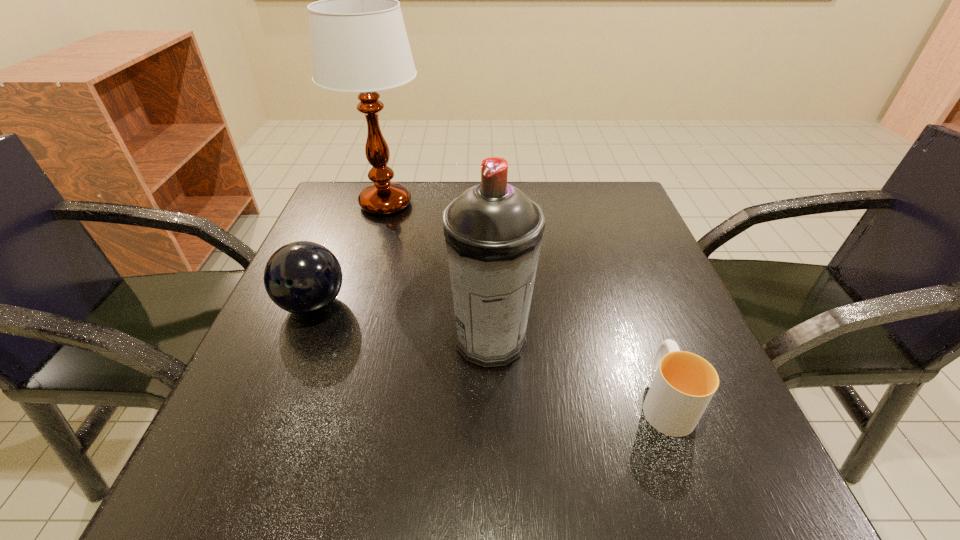
Image resolution: width=960 pixels, height=540 pixels. What are the coordinates of `vacant region that satisfies the following two spatial constraints: 1. on the side of the aerosol can with the finger holes; 2. on the right side of the bowling ball` in the screenshot? It's located at (299, 340).

You are a GUI agent. You are given a task and a screenshot of the screen. Output one action in this format:
    pyautogui.click(x=<x>, y=<y>)
    Task: Click on the vacant space that satisfies the following two spatial constraints: 1. on the side of the third object from left to right with the finger holes; 2. on the left side of the third tallest object
    This screenshot has height=540, width=960.
    Given the screenshot: What is the action you would take?
    pyautogui.click(x=299, y=340)